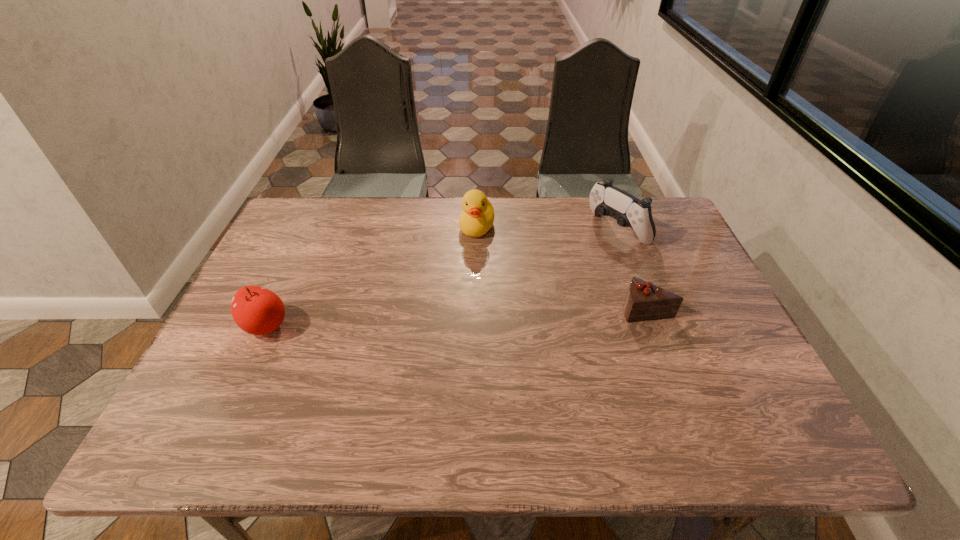
Where is `free area in between the chocolate cake and the control`? free area in between the chocolate cake and the control is located at coordinates (632, 269).

You are a GUI agent. You are given a task and a screenshot of the screen. Output one action in this format:
    pyautogui.click(x=<x>, y=<y>)
    Task: Click on the unoccupied area between the chocolate cake and the second object from left to right
    
    Given the screenshot: What is the action you would take?
    pyautogui.click(x=562, y=268)

The image size is (960, 540). Identify the location of free space between the leftmost object and the chocolate cake. (456, 318).

Locate which object ranks in proximity to the chocolate cake. Please provide its 2D coordinates. Your answer should be formatted as a tuple, i.e. [(x, y)], where the tuple contains the x and y coordinates of a point satisfying the conditions above.

[(607, 200)]

Choose which object is the third nearest neighbor to the control. Please provide its 2D coordinates. Your answer should be formatted as a tuple, i.e. [(x, y)], where the tuple contains the x and y coordinates of a point satisfying the conditions above.

[(256, 310)]

I want to click on free spot that satisfies the following two spatial constraints: 1. on the back side of the chocolate cake; 2. on the right side of the apple, so click(x=274, y=309).

This screenshot has height=540, width=960. Identify the location of free space in the image that satisfies the following two spatial constraints: 1. on the front side of the third object from right to left; 2. on the left side of the control. (477, 230).

This screenshot has height=540, width=960. Identify the location of vacant space that satisfies the following two spatial constraints: 1. on the front side of the duck; 2. on the left side of the control. click(477, 230).